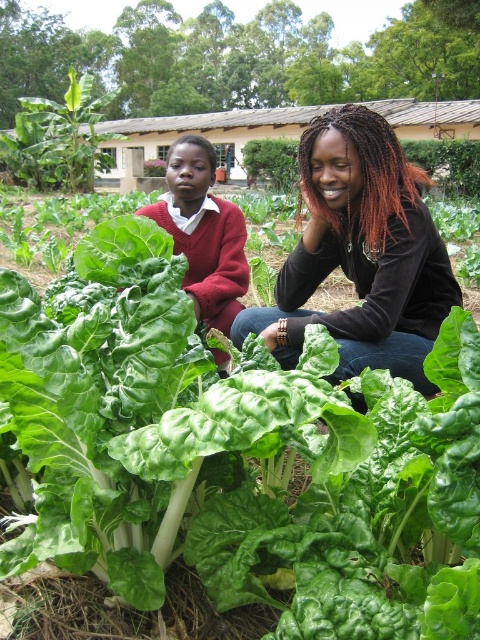
Which is more to the left, black matte shirt at center or matte red sweater at center?

matte red sweater at center is more to the left.

Does black matte shirt at center appear on the right side of matte red sweater at center?

Yes, black matte shirt at center is to the right of matte red sweater at center.

This screenshot has height=640, width=480. What are the coordinates of `black matte shirt at center` in the screenshot? It's located at (360, 253).